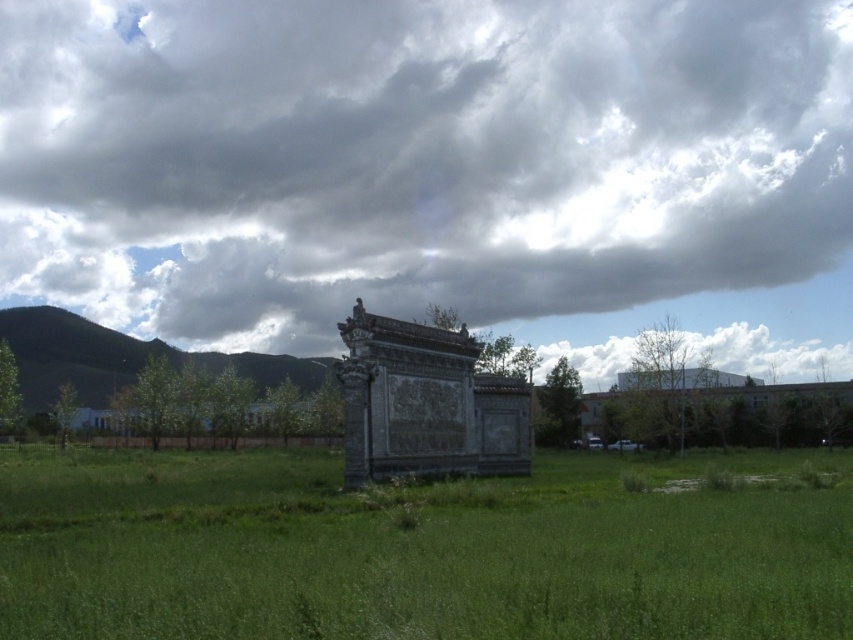
Can you confirm if dark gray stone monument at center is positioned to the left of green grassy hill at left?

In fact, dark gray stone monument at center is to the right of green grassy hill at left.

The image size is (853, 640). What are the coordinates of `dark gray stone monument at center` in the screenshot? It's located at (425, 403).

The width and height of the screenshot is (853, 640). Find the location of `dark gray stone monument at center`. dark gray stone monument at center is located at coordinates (425, 403).

Which is in front, point (498, 611) or point (453, 397)?

Positioned in front is point (498, 611).

Identify the location of green grass at center. The image size is (853, 640). (419, 548).

From the picture: Does green grass at center appear over green grassy hill at left?

Incorrect, green grass at center is not positioned above green grassy hill at left.

Is point (509, 611) closer to viewer compared to point (62, 344)?

Yes, point (509, 611) is closer to viewer.

Identify the location of green grass at center. The height and width of the screenshot is (640, 853). (419, 548).